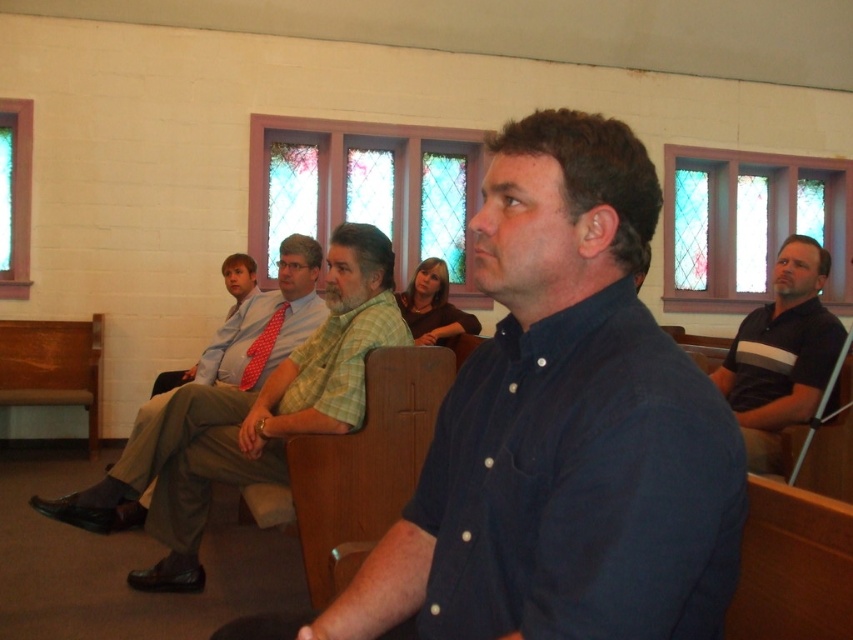
Which is below, black striped polo shirt at right or matte red tie at center?

black striped polo shirt at right is below.

Looking at this image, is black striped polo shirt at right thinner than matte red tie at center?

No.

Is point (767, 321) in front of point (251, 268)?

That is True.

The image size is (853, 640). What are the coordinates of `black striped polo shirt at right` in the screenshot? It's located at (781, 353).

Between light blue shirt at center and black striped polo shirt at right, which one is positioned higher?

Positioned higher is black striped polo shirt at right.

Who is positioned more to the right, light blue shirt at center or black striped polo shirt at right?

black striped polo shirt at right is more to the right.

Which is in front, point (283, 298) or point (740, 344)?

Point (740, 344) is more forward.

You are a GUI agent. You are given a task and a screenshot of the screen. Output one action in this format:
    pyautogui.click(x=<x>, y=<y>)
    Task: Click on the light blue shirt at center
    The height and width of the screenshot is (640, 853).
    Given the screenshot: What is the action you would take?
    [206, 387]

Which is in front, point (491, 611) or point (795, 298)?

Point (491, 611) is more forward.

Can you confirm if dark blue button-up shirt at center is positioned below black striped polo shirt at right?

No.

What do you see at coordinates (564, 428) in the screenshot? I see `dark blue button-up shirt at center` at bounding box center [564, 428].

Where is `dark blue button-up shirt at center`? The width and height of the screenshot is (853, 640). dark blue button-up shirt at center is located at coordinates (564, 428).